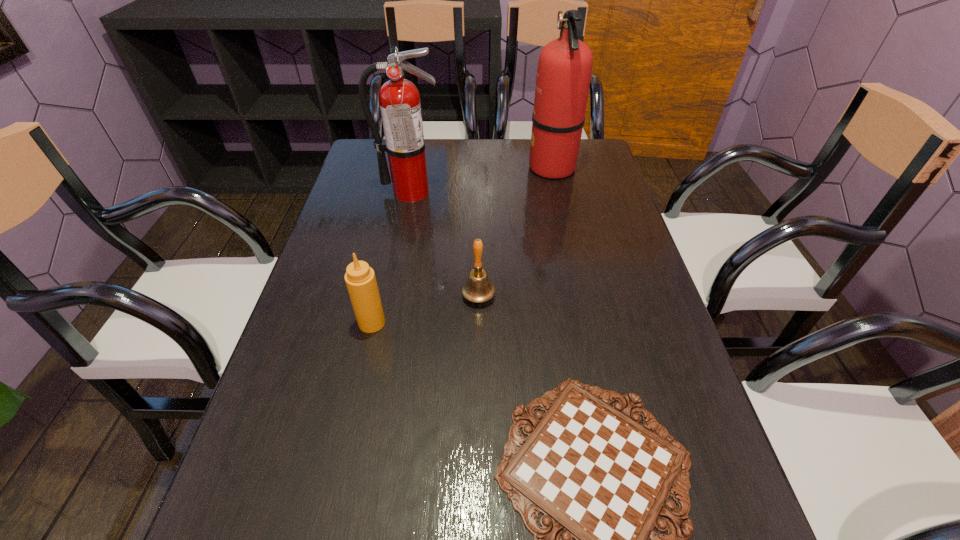
Identify which object is located as the fourth nearest to the condiment. Please provide its 2D coordinates. Your answer should be formatted as a tuple, i.e. [(x, y)], where the tuple contains the x and y coordinates of a point satisfying the conditions above.

[(564, 70)]

I want to click on object that stands as the second closest to the bell, so click(598, 476).

Image resolution: width=960 pixels, height=540 pixels. In order to click on vacant space that satisfies the following two spatial constraints: 1. on the nozzle side of the left fire extinguisher; 2. on the right side of the third nearest object in this screenshot , I will do tap(390, 296).

Locate an element on the screen. free space that satisfies the following two spatial constraints: 1. on the side of the right fire extinguisher with the nozzle and handle; 2. on the nozzle side of the left fire extinguisher is located at coordinates (557, 192).

The image size is (960, 540). I want to click on vacant space that satisfies the following two spatial constraints: 1. on the nozzle side of the left fire extinguisher; 2. on the right side of the fourth tallest object, so click(x=390, y=296).